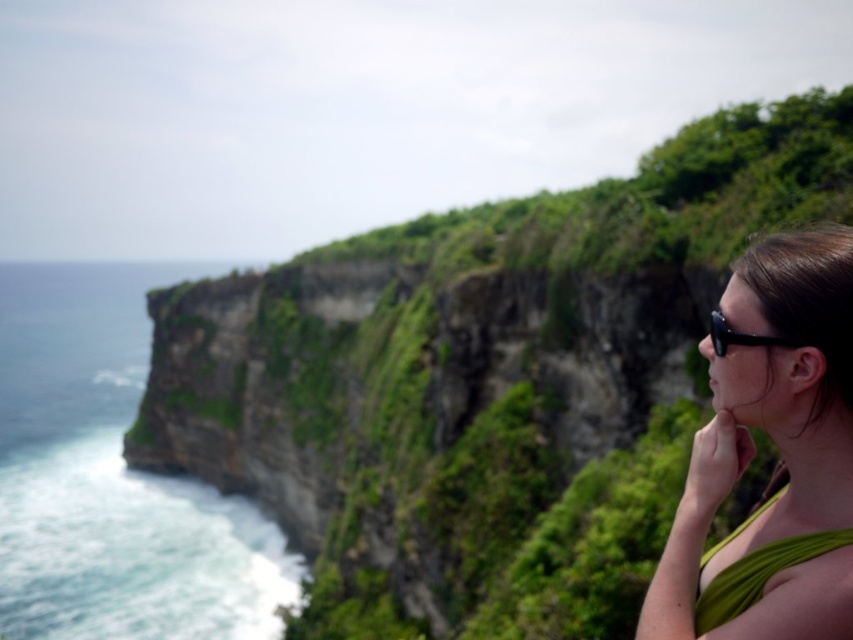
Question: Based on their relative distances, which object is farther from the green fabric top at right?

Choices:
 (A) green leafy vegetation at center
 (B) black plastic goggles at right

Answer: (A)

Question: Does green fabric bikini top at right have a smaller size compared to black plastic goggles at right?

Choices:
 (A) yes
 (B) no

Answer: (B)

Question: Does green fabric bikini top at right come in front of black plastic goggles at right?

Choices:
 (A) no
 (B) yes

Answer: (B)

Question: Estimate the real-world distances between objects in this image. Which object is farther from the green leafy vegetation at center?

Choices:
 (A) green fabric bikini top at right
 (B) black plastic goggles at right

Answer: (B)

Question: Can you confirm if green fabric bikini top at right is positioned to the left of black plastic goggles at right?

Choices:
 (A) yes
 (B) no

Answer: (A)

Question: Which object is closer to the camera taking this photo?

Choices:
 (A) black plastic goggles at right
 (B) green fabric bikini top at right
 (C) green fabric top at right
 (D) green leafy vegetation at center

Answer: (C)